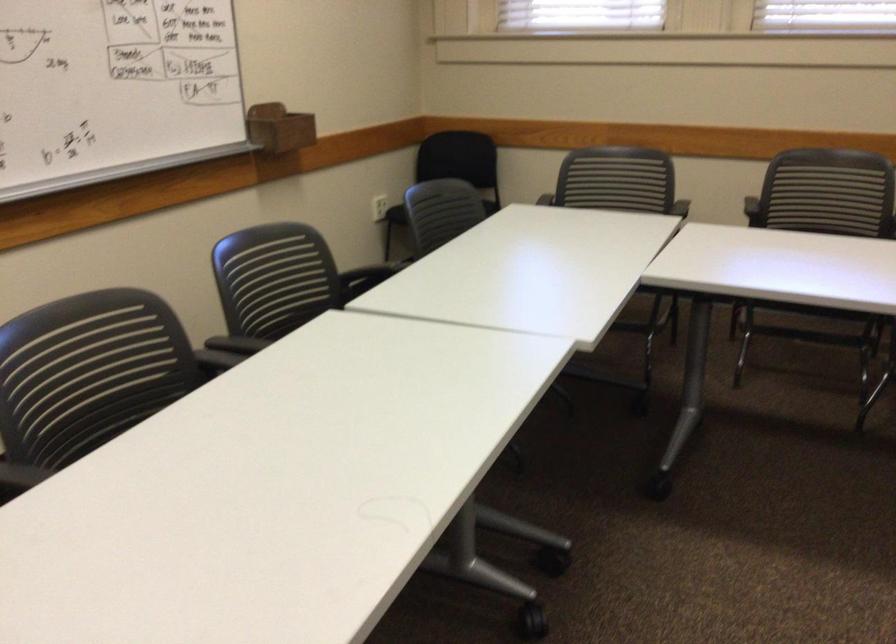
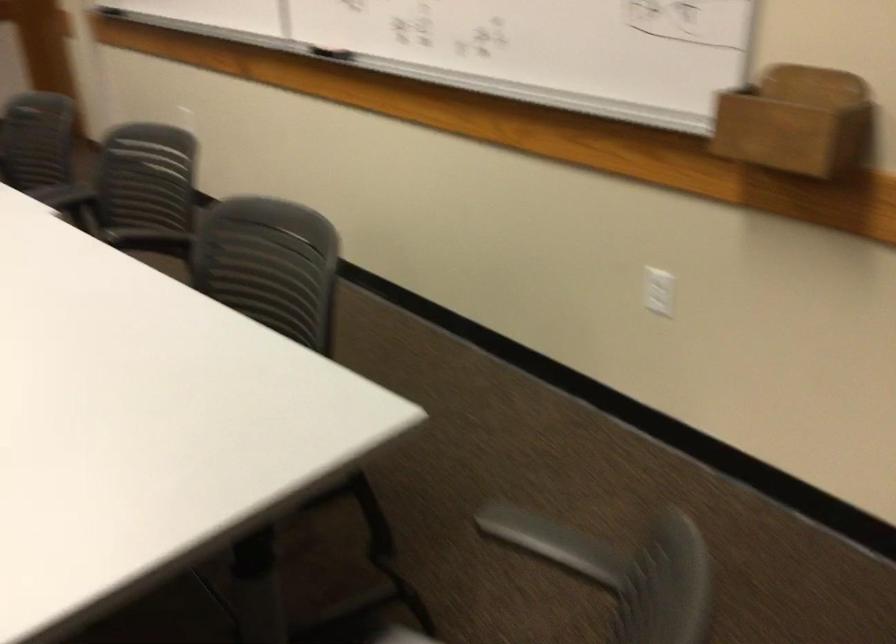
Find the pixel in the second image that matches point 295,129 in the first image.

(797, 122)